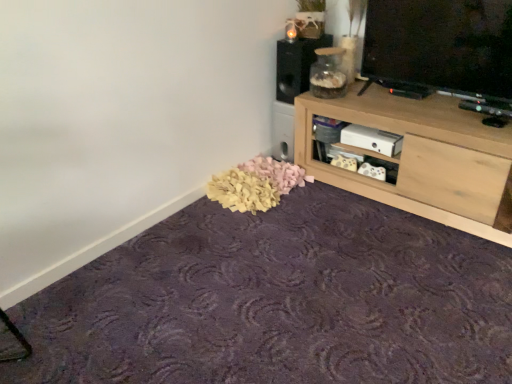
The height and width of the screenshot is (384, 512). I want to click on vacant space to the right of transparent glass jar at upper right, so click(x=365, y=91).